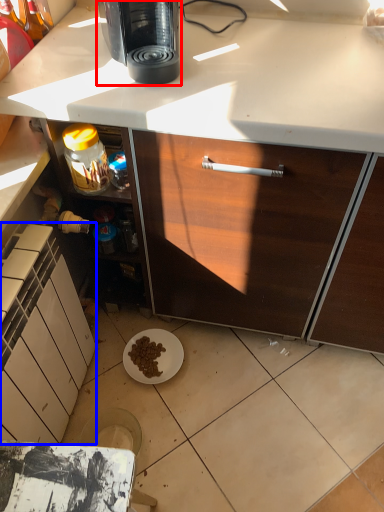
Question: Which object appears farthest to the camera in this image, coffee maker (highlighted by a red box) or cabinetry (highlighted by a blue box)?

Choices:
 (A) coffee maker
 (B) cabinetry

Answer: (A)